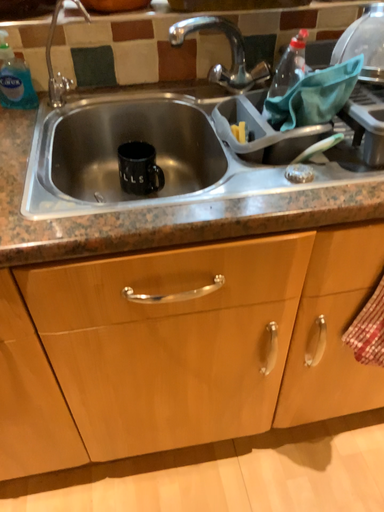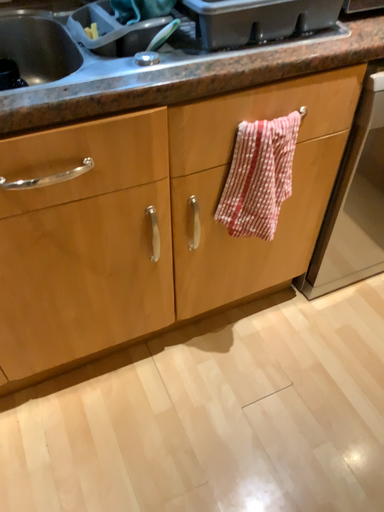
Question: How did the camera likely rotate when shooting the video?

Choices:
 (A) rotated left
 (B) rotated right

Answer: (B)